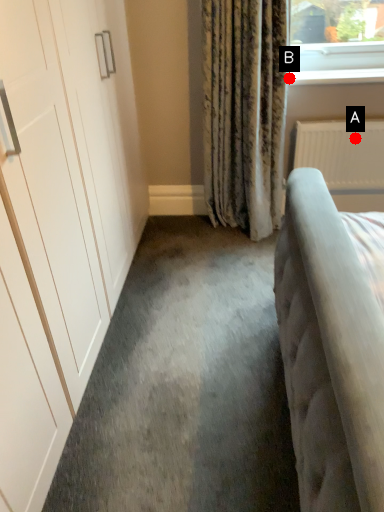
Question: Two points are circled on the image, labeled by A and B beside each circle. Which point is farther to the camera?

Choices:
 (A) A is further
 (B) B is further

Answer: (A)